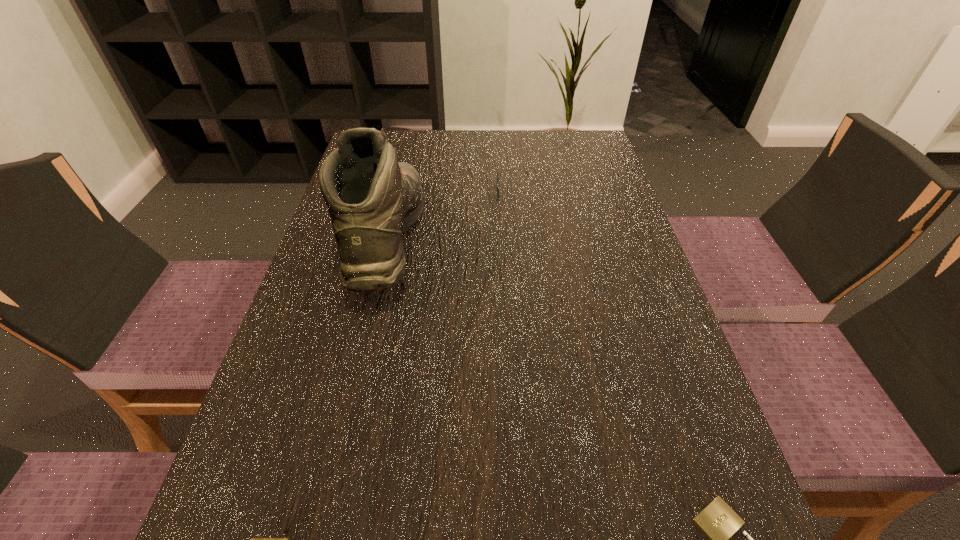
This screenshot has height=540, width=960. In order to click on vacant position at the right edge of the desktop in this screenshot , I will do `click(660, 335)`.

Locate an element on the screen. The image size is (960, 540). vacant region at the far right corner of the desktop is located at coordinates (596, 161).

At what (x,y) coordinates should I click in order to perform the action: click on unoccupied area between the tallest object and the second tallest object. Please return your answer as a coordinate pair (x, y). This screenshot has height=540, width=960. Looking at the image, I should click on (449, 215).

Find the location of a particular element. The width and height of the screenshot is (960, 540). vacant space that's between the tallest object and the sunglasses is located at coordinates (449, 215).

Locate which object ranks in proximity to the ski boot. Please provide its 2D coordinates. Your answer should be formatted as a tuple, i.e. [(x, y)], where the tuple contains the x and y coordinates of a point satisfying the conditions above.

[(498, 192)]

Select which object appears as the third closest to the tallest object. Please provide its 2D coordinates. Your answer should be formatted as a tuple, i.e. [(x, y)], where the tuple contains the x and y coordinates of a point satisfying the conditions above.

[(718, 521)]